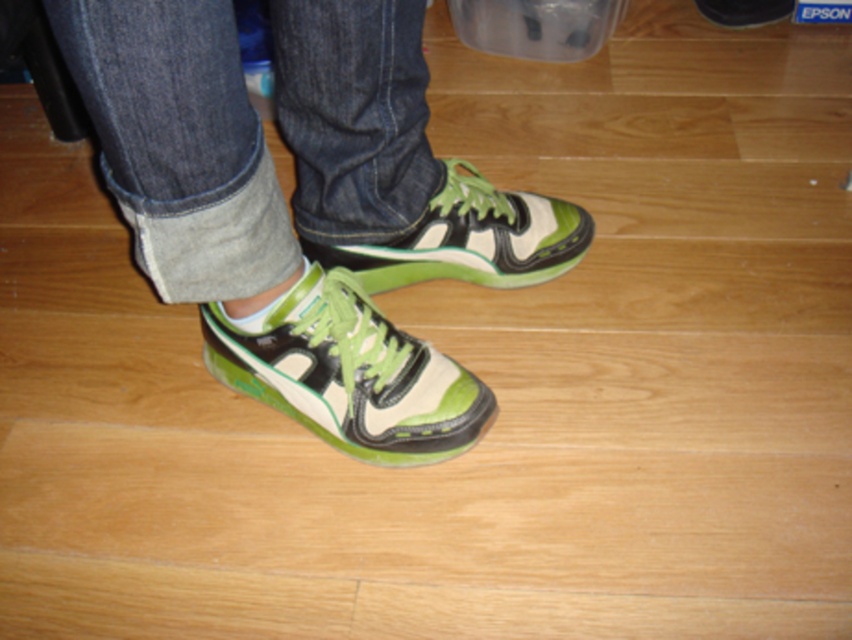
You are a photographer setting up a shot of the person. The focus point of your camera is at point [154,276]. You want to ensure that the sneakers are in focus. Given that the focus range of your camera is 30 to 40 inches from the viewer, will the sneakers be in focus?

The point [154,276] is 34.77 inches from the viewer, which falls within the focus range of 30 to 40 inches. Therefore, the sneakers will be in focus.

Based on the photo, you are taking a photo of the wooden floor and need to focus on either point (294, 22) or point (450, 243). Which point should you focus on to ensure it appears sharp in the foreground?

Point (294, 22) is closer to the camera than point (450, 243), so you should focus on point (294, 22) to ensure it appears sharp in the foreground.